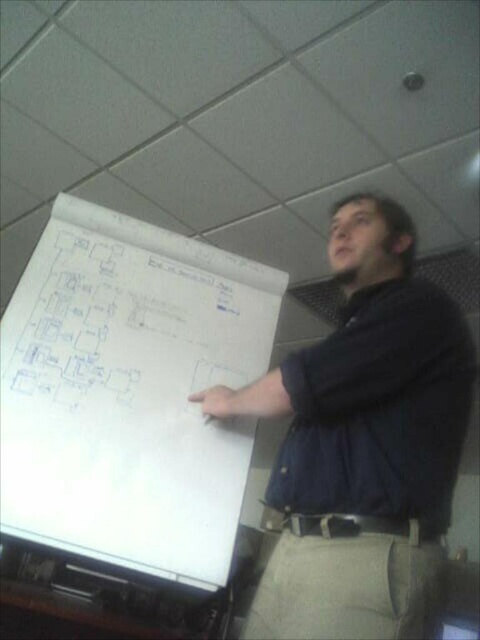
Looking at this image, you are an attendee at a presentation and want to locate the presenter. Where is the dark blue shirt at upper center positioned in the image?

The dark blue shirt at upper center is positioned at point coordinates of 0.692 on the x axis and 0.758 on the y axis.

You are a person standing 1.6 meters tall. You want to reach the dark blue fabric shirt at right that is 1.04 meters away from you. Can you touch it without moving your feet?

The dark blue fabric shirt at right is 1.04 meters away from the viewer. Since the average arm length for a person of 1.6 meters tall is approximately 0.7 meters, you would not be able to reach it without moving your feet.

You are an attendee at a presentation and see the presenter pointing at two points on the flip chart. The points are labeled as point (373, 333) and point (158, 272). Which point is closer to the presenter?

Point (373, 333) is in front of point (158, 272), so it is closer to the presenter.